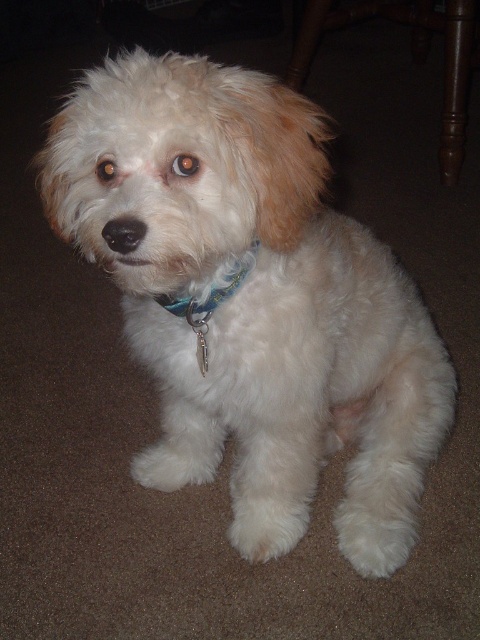
Question: Which of the following is the farthest from the observer?

Choices:
 (A) white fluffy dog at center
 (B) blue fabric collar at center

Answer: (B)

Question: Can you confirm if white fluffy dog at center is positioned above blue fabric collar at center?

Choices:
 (A) no
 (B) yes

Answer: (A)

Question: Which of the following is the farthest from the observer?

Choices:
 (A) white fluffy dog at center
 (B) blue fabric collar at center

Answer: (B)

Question: Can you confirm if white fluffy dog at center is positioned above blue fabric collar at center?

Choices:
 (A) no
 (B) yes

Answer: (A)

Question: In this image, where is white fluffy dog at center located relative to blue fabric collar at center?

Choices:
 (A) above
 (B) below

Answer: (B)